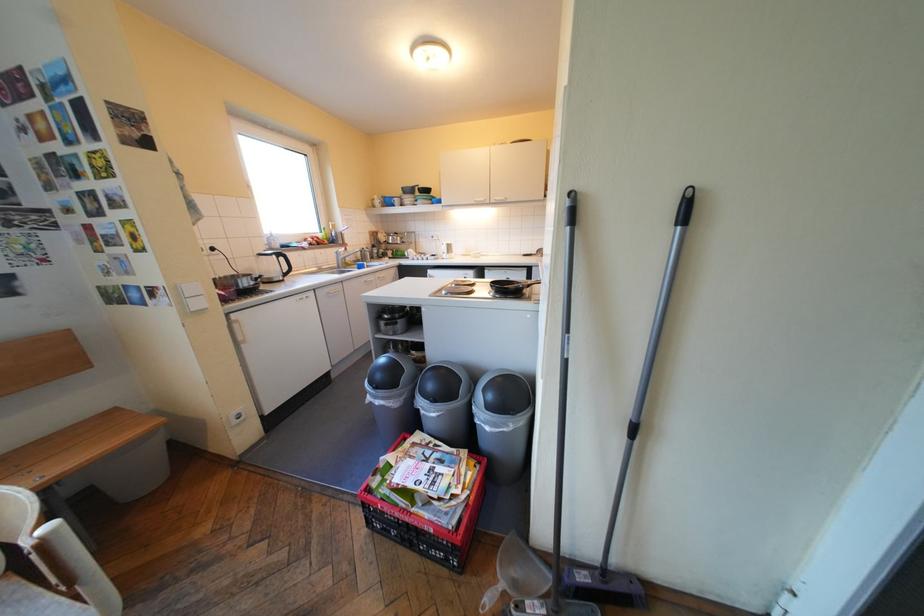
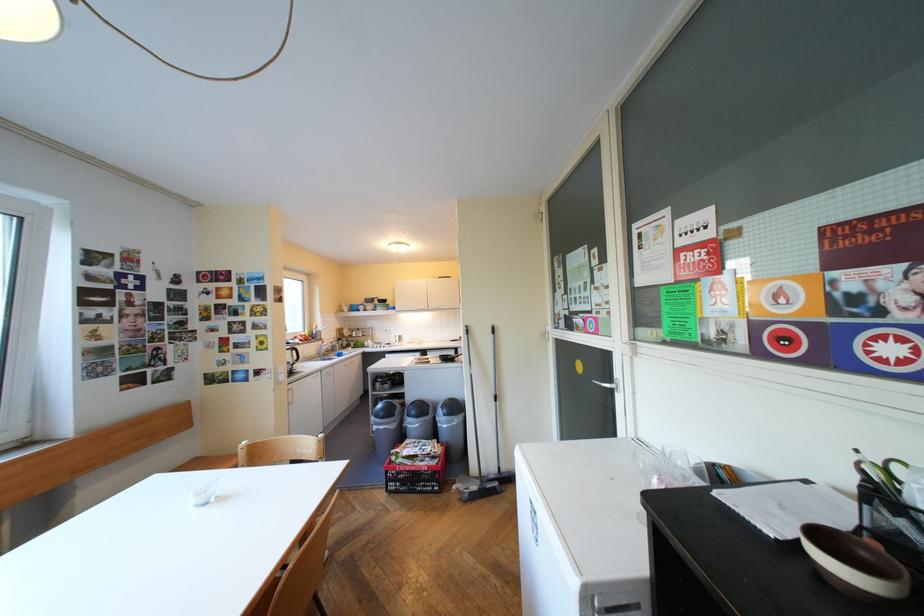
The point at (189, 286) is marked in the first image. Where is the corresponding point in the second image?

(288, 368)